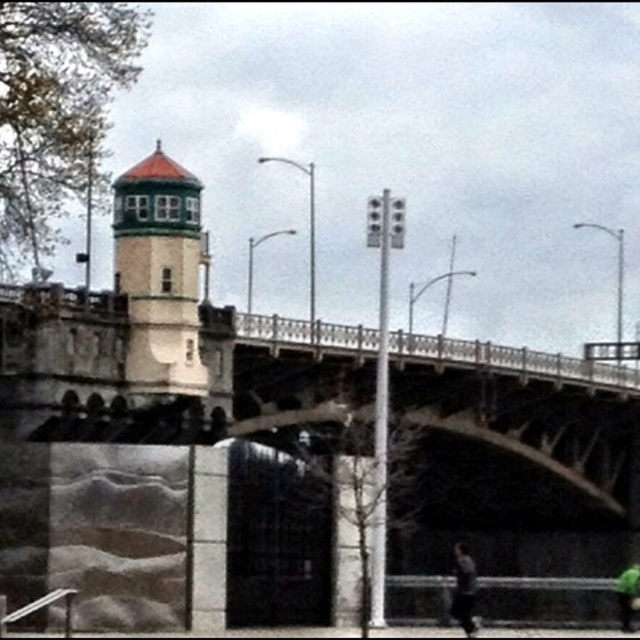
Question: Is dark gray smooth skateboarder at lower right positioned behind green matte skateboard at lower right?

Choices:
 (A) yes
 (B) no

Answer: (B)

Question: Observing the image, what is the correct spatial positioning of concrete bridge at center in reference to green matte skateboard at lower right?

Choices:
 (A) below
 (B) above

Answer: (B)

Question: Can you confirm if white painted brick bell tower at upper left is positioned to the right of green matte skateboard at lower right?

Choices:
 (A) no
 (B) yes

Answer: (A)

Question: Which of the following is the farthest from the observer?

Choices:
 (A) (627, 611)
 (B) (474, 577)

Answer: (A)

Question: Among these objects, which one is nearest to the camera?

Choices:
 (A) green matte skateboard at lower right
 (B) dark gray smooth skateboarder at lower right
 (C) white painted brick bell tower at upper left
 (D) concrete bridge at center

Answer: (B)

Question: Based on their relative distances, which object is farther from the white painted brick bell tower at upper left?

Choices:
 (A) dark gray smooth skateboarder at lower right
 (B) concrete bridge at center

Answer: (A)